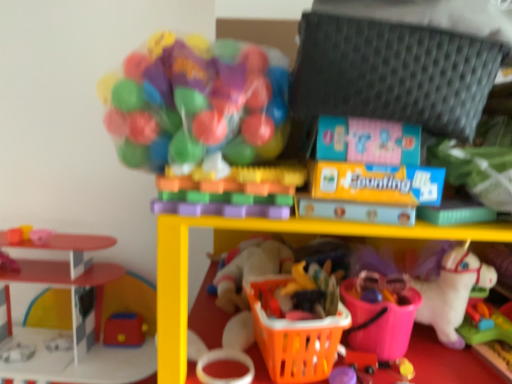
Question: From the image's perspective, is translucent plastic blocks at center, which is the 6th toy in left-to-right order, positioned above or below orange plastic basket at lower center?

Choices:
 (A) above
 (B) below

Answer: (A)

Question: From a real-world perspective, is translucent plastic blocks at center, which is the 3th toy in right-to-left order, positioned above or below orange plastic basket at lower center?

Choices:
 (A) below
 (B) above

Answer: (B)

Question: Estimate the real-world distances between objects in this image. Which object is closer to the orange plastic basket at lower center?

Choices:
 (A) rubberized red toy at lower left, the fourth toy viewed from the left
 (B) translucent plastic ball pit at upper center, which ranks as the fifth toy in left-to-right order
 (C) rubberized plastic toy at lower right, which is counted as the eighth toy, starting from the left
 (D) smooth plastic toy at left, which is the 8th toy from right to left
 (E) orange plastic basket at lower center, which is counted as the 1th basket, starting from the right

Answer: (B)

Question: Which of these objects is positioned closest to the smooth plastic playhouse at left, the 3th toy in the left-to-right sequence?

Choices:
 (A) smooth plastic toy at left, which is the 8th toy from right to left
 (B) rubberized plastic toy at lower right, which is counted as the eighth toy, starting from the left
 (C) rubber yellow ball at lower center, which ranks as the seventh toy in left-to-right order
 (D) pink rubber ball at left, the second toy in the left-to-right sequence
 (E) orange plastic basket at lower center

Answer: (D)